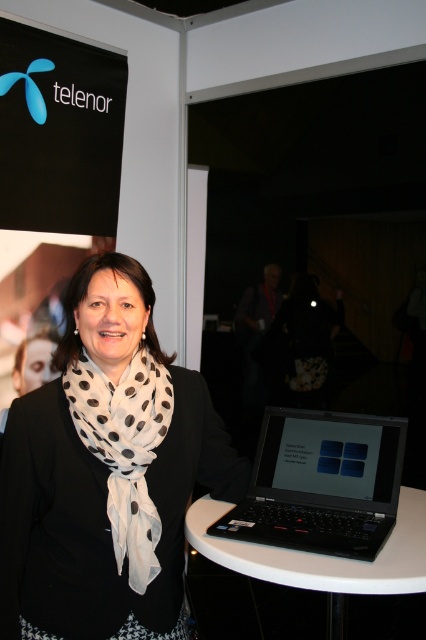
Question: Considering the relative positions of white glossy round table at center and white sheer scarf at center in the image provided, where is white glossy round table at center located with respect to white sheer scarf at center?

Choices:
 (A) above
 (B) below

Answer: (B)

Question: Is black matte laptop at lower right thinner than white sheer scarf at center?

Choices:
 (A) yes
 (B) no

Answer: (B)

Question: Is white glossy round table at center below black matte laptop at lower right?

Choices:
 (A) no
 (B) yes

Answer: (B)

Question: Which of the following is the farthest from the observer?

Choices:
 (A) white dotted scarf at center
 (B) white sheer scarf at center
 (C) black matte laptop at lower right

Answer: (C)

Question: Which point is closer to the camera?

Choices:
 (A) white glossy round table at center
 (B) white sheer scarf at center
 (C) white dotted scarf at center

Answer: (C)

Question: Which point is farther from the camera taking this photo?

Choices:
 (A) (120, 570)
 (B) (345, 460)
 (C) (14, 428)

Answer: (B)